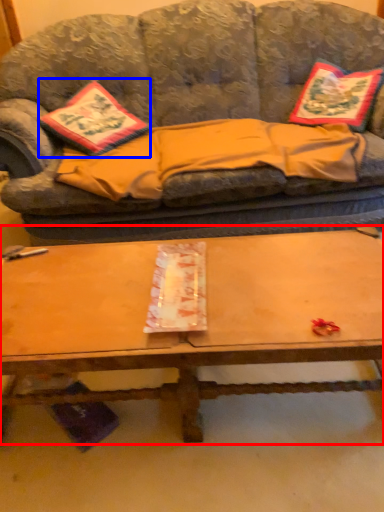
Question: Which object appears farthest to the camera in this image, coffee table (highlighted by a red box) or throw pillow (highlighted by a blue box)?

Choices:
 (A) coffee table
 (B) throw pillow

Answer: (B)